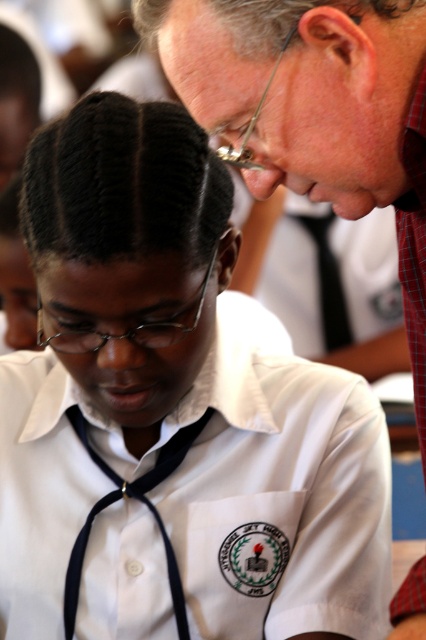
From the picture: You are a photographer trying to capture a clear shot of both the white fabric shirt at center and the matte red shirt at upper right. Which shirt should you focus on first to ensure both are in focus?

You should focus on the white fabric shirt at center first because it is closer to you than the matte red shirt at upper right. By focusing on the closer object, the farther one will also be in focus due to the depth of field.

You are observing a scene where a young girl and an older man are in a classroom. You notice two objects labeled as the white fabric shirt at center and the matte black forehead at center. Based on their positions, which object is located to the right side of the other?

The white fabric shirt at center is to the right of the matte black forehead at center.

You are a photographer trying to capture a candid shot of both the white fabric shirt at center and the matte red shirt at upper right in the scene. Since you can only focus on one subject at a time, which shirt should you aim your camera at first to ensure the other is still in the frame?

You should aim your camera at the white fabric shirt at center first because it is positioned to the left of the matte red shirt at upper right, so capturing the left side first will keep the right side in the frame.